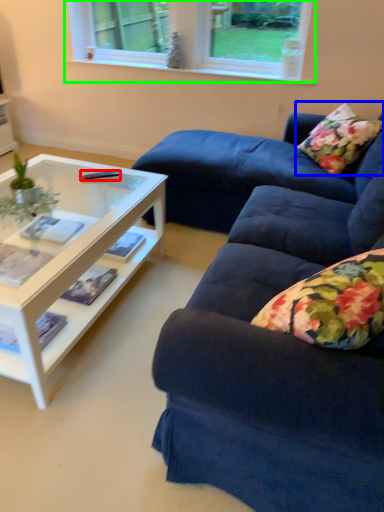
Question: Which object is the closest to the remote control (highlighted by a red box)? Choose among these: pillow (highlighted by a blue box) or window (highlighted by a green box).

Choices:
 (A) pillow
 (B) window

Answer: (A)